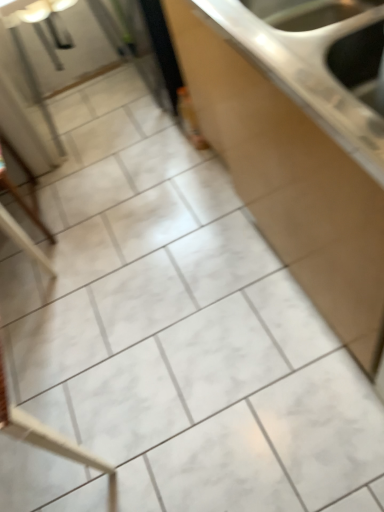
Question: Relative to white glossy countertop at center, is wooden chair at left in front or behind?

Choices:
 (A) behind
 (B) front

Answer: (A)

Question: Is wooden chair at left situated inside white glossy countertop at center or outside?

Choices:
 (A) outside
 (B) inside

Answer: (A)

Question: From the image's perspective, is wooden chair at left above or below white glossy countertop at center?

Choices:
 (A) above
 (B) below

Answer: (B)

Question: From the image's perspective, is white glossy countertop at center located above or below wooden chair at left?

Choices:
 (A) below
 (B) above

Answer: (B)

Question: Visually, is white glossy countertop at center positioned to the left or to the right of wooden chair at left?

Choices:
 (A) right
 (B) left

Answer: (A)

Question: In terms of height, does white glossy countertop at center look taller or shorter compared to wooden chair at left?

Choices:
 (A) tall
 (B) short

Answer: (A)

Question: Considering their positions, is white glossy countertop at center located in front of or behind wooden chair at left?

Choices:
 (A) front
 (B) behind

Answer: (A)